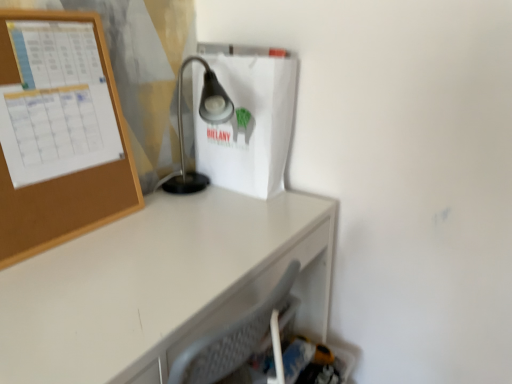
Question: Is satin black lamp at center bigger or smaller than white matte paper bag at center?

Choices:
 (A) small
 (B) big

Answer: (B)

Question: Is satin black lamp at center wider or thinner than white matte paper bag at center?

Choices:
 (A) thin
 (B) wide

Answer: (B)

Question: Considering the real-world distances, which object is closest to the white glossy desk at center?

Choices:
 (A) white matte paper bag at center
 (B) satin black lamp at center
 (C) corkboard at upper left

Answer: (C)

Question: Which is nearer to the corkboard at upper left?

Choices:
 (A) white matte paper bag at center
 (B) satin black lamp at center
 (C) white glossy desk at center

Answer: (C)